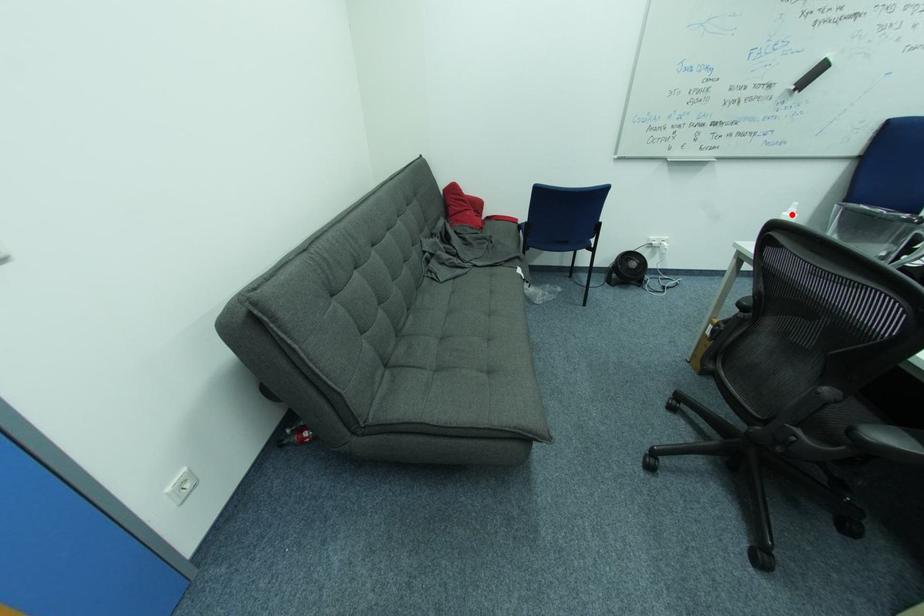
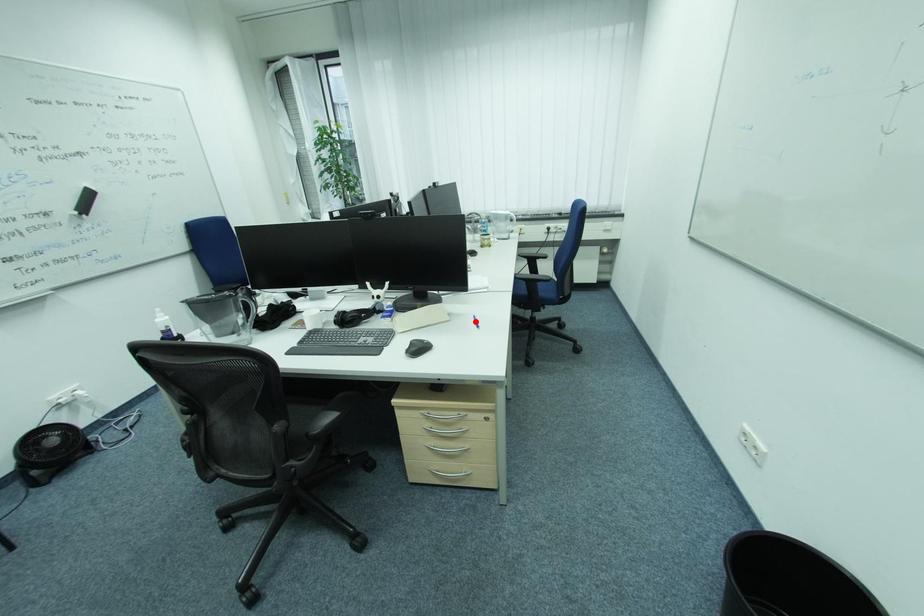
I am providing you with two images of the same scene from different viewpoints. A red point is marked on the first image and another point is marked on the second image. Are the points marked in image1 and image2 representing the same 3D position?

No